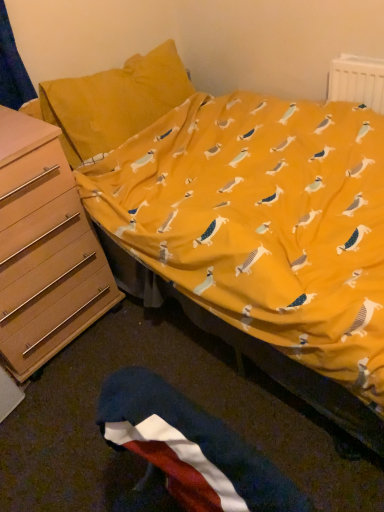
Measure the distance between point (28, 307) and camera.

The distance of point (28, 307) from camera is 4.69 feet.

The image size is (384, 512). Find the location of `polyester flag at lower center`. polyester flag at lower center is located at coordinates (191, 448).

Looking at this image, in terms of size, does white plastic radiator at upper right appear bigger or smaller than light brown wooden chest of drawers at left?

In the image, white plastic radiator at upper right appears to be smaller than light brown wooden chest of drawers at left.

Does white plastic radiator at upper right come in front of light brown wooden chest of drawers at left?

No, white plastic radiator at upper right is further to the viewer.

Based on the photo, choose the correct answer: Is white plastic radiator at upper right inside light brown wooden chest of drawers at left or outside it?

white plastic radiator at upper right is spatially situated outside light brown wooden chest of drawers at left.

Which is closer to the camera, (x=372, y=83) or (x=70, y=324)?

The point (x=372, y=83) is in front.

Is polyester flag at lower center aimed at white plastic radiator at upper right?

No, polyester flag at lower center is not facing towards white plastic radiator at upper right.

From a real-world perspective, which is physically below, polyester flag at lower center or white plastic radiator at upper right?

In real-world perspective, polyester flag at lower center is lower.

Is the surface of polyester flag at lower center in direct contact with white plastic radiator at upper right?

No, polyester flag at lower center is not touching white plastic radiator at upper right.

How different are the orientations of polyester flag at lower center and white plastic radiator at upper right in degrees?

They differ by 0.19 degrees in their facing directions.

From a real-world perspective, is white plastic radiator at upper right above or below polyester flag at lower center?

white plastic radiator at upper right is above polyester flag at lower center.

Is polyester flag at lower center inside white plastic radiator at upper right?

That's incorrect, polyester flag at lower center is not inside white plastic radiator at upper right.

Considering the sizes of objects white plastic radiator at upper right and polyester flag at lower center in the image provided, who is shorter, white plastic radiator at upper right or polyester flag at lower center?

white plastic radiator at upper right is shorter.

Is point (350, 86) more distant than point (199, 426)?

Yes, point (350, 86) is behind point (199, 426).

What's the angular difference between light brown wooden chest of drawers at left and polyester flag at lower center's facing directions?

light brown wooden chest of drawers at left and polyester flag at lower center are facing 90.3 degrees away from each other.

Is the position of light brown wooden chest of drawers at left less distant than that of polyester flag at lower center?

A: No, light brown wooden chest of drawers at left is further to the viewer.

Does point (9, 307) come farther from viewer compared to point (212, 418)?

Yes, it is behind point (212, 418).

Is light brown wooden chest of drawers at left inside the boundaries of polyester flag at lower center, or outside?

light brown wooden chest of drawers at left is outside polyester flag at lower center.

Can you confirm if polyester flag at lower center is smaller than light brown wooden chest of drawers at left?

Yes.

Is polyester flag at lower center not inside light brown wooden chest of drawers at left?

polyester flag at lower center lies outside light brown wooden chest of drawers at left's area.

In the scene shown: Does polyester flag at lower center turn towards light brown wooden chest of drawers at left?

No, polyester flag at lower center is not aimed at light brown wooden chest of drawers at left.

From the image's perspective, between light brown wooden chest of drawers at left and white plastic radiator at upper right, who is located below?

light brown wooden chest of drawers at left.

Considering the relative positions of light brown wooden chest of drawers at left and white plastic radiator at upper right in the image provided, is light brown wooden chest of drawers at left to the left of white plastic radiator at upper right from the viewer's perspective?

Yes.

Is white plastic radiator at upper right located within light brown wooden chest of drawers at left?

That's incorrect, white plastic radiator at upper right is not inside light brown wooden chest of drawers at left.

Where is `the chest of drawers lying below the white plastic radiator at upper right (from the image's perspective)`? This screenshot has width=384, height=512. the chest of drawers lying below the white plastic radiator at upper right (from the image's perspective) is located at coordinates (44, 249).

Find the location of a particular element. This screenshot has height=512, width=384. radiator on the right of polyester flag at lower center is located at coordinates (357, 80).

Based on their spatial positions, is white plastic radiator at upper right or light brown wooden chest of drawers at left closer to polyester flag at lower center?

The object closer to polyester flag at lower center is light brown wooden chest of drawers at left.

Based on their spatial positions, is light brown wooden chest of drawers at left or white plastic radiator at upper right further from polyester flag at lower center?

The object further to polyester flag at lower center is white plastic radiator at upper right.

When comparing their distances from light brown wooden chest of drawers at left, does polyester flag at lower center or white plastic radiator at upper right seem closer?

polyester flag at lower center.

When comparing their distances from light brown wooden chest of drawers at left, does white plastic radiator at upper right or polyester flag at lower center seem further?

white plastic radiator at upper right lies further to light brown wooden chest of drawers at left than the other object.

Based on their spatial positions, is polyester flag at lower center or light brown wooden chest of drawers at left closer to white plastic radiator at upper right?

Among the two, light brown wooden chest of drawers at left is located nearer to white plastic radiator at upper right.

Estimate the real-world distances between objects in this image. Which object is further from white plastic radiator at upper right, light brown wooden chest of drawers at left or polyester flag at lower center?

polyester flag at lower center is further to white plastic radiator at upper right.

The image size is (384, 512). I want to click on flag between light brown wooden chest of drawers at left and white plastic radiator at upper right, so click(x=191, y=448).